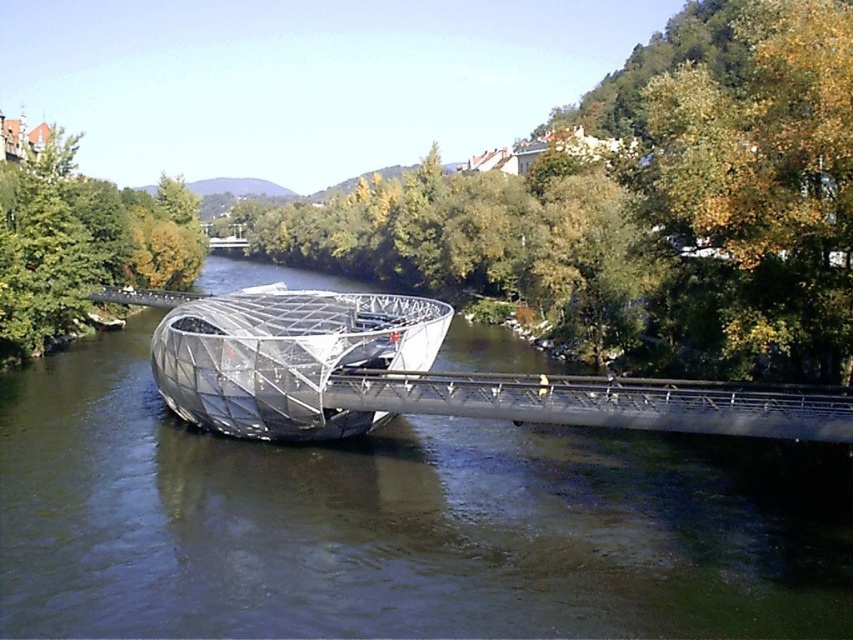
Consider the image. You are a tourist standing on the bridge and looking down. You see the clear water at bridge center and the transparent glass boat at center. Which object is directly above the other?

The transparent glass boat at center is directly above the clear water at bridge center because the clear water at bridge center is located below the transparent glass boat at center.

You are a tourist standing on the bridge and see the clear water at bridge center and the transparent glass boat at center. Which object is bigger in size?

The clear water at bridge center is larger in size than the transparent glass boat at center.